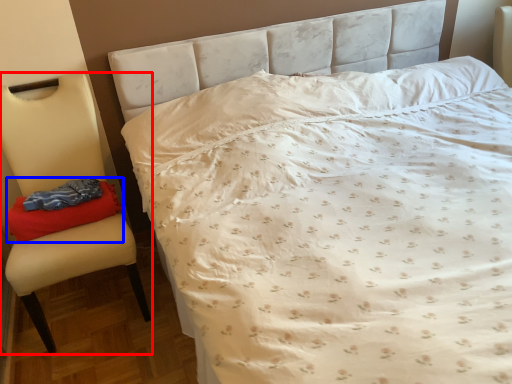
Question: Which of the following is the farthest to the observer, chair (highlighted by a red box) or material (highlighted by a blue box)?

Choices:
 (A) chair
 (B) material

Answer: (B)